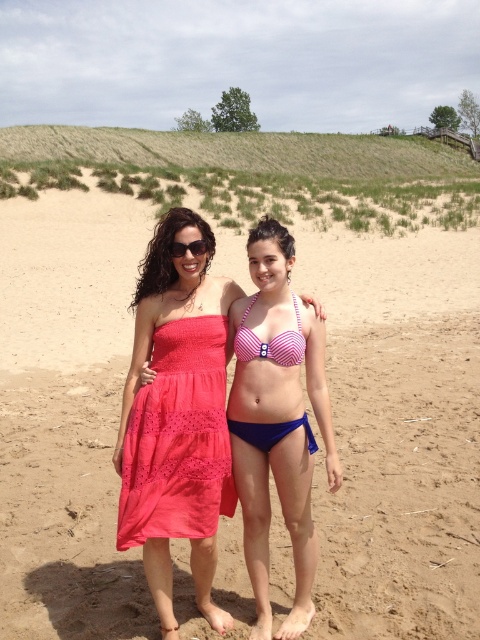
You are a photographer trying to capture a clear shot of both the pink striped bikini at center and the matte coral dress at center. Which one is blocking the view of the other?

The matte coral dress at center is behind the pink striped bikini at center, so the pink striped bikini at center is blocking the view of the matte coral dress at center.

You are a photographer trying to capture a closeup of the pink striped bikini at center and the black plastic sunglasses at upper center. Which object should you zoom in on first to ensure it fills the frame more?

The pink striped bikini at center has a greater height compared to the black plastic sunglasses at upper center, so you should zoom in on the pink striped bikini at center first to ensure it fills the frame more.

Consider the image. You are standing at the point marked as point [173,458] on the beach. You want to take a photo of the two people in the scene. Can you see them clearly from your current position?

Yes, you can see the two people clearly from point [173,458] because the distance between you and the viewer is 10.10 feet, which is a reasonable distance for clear visibility.